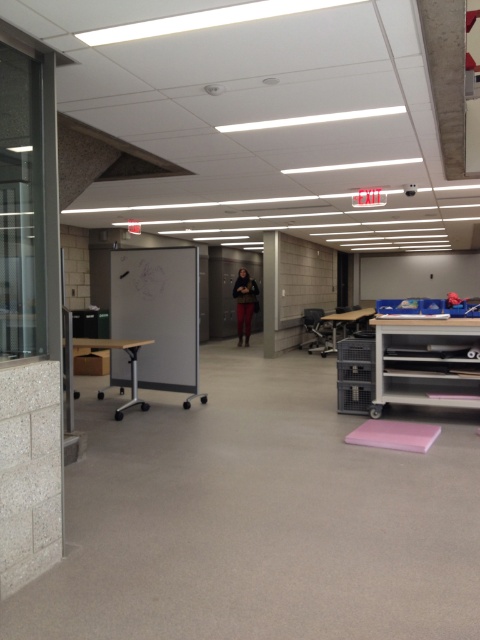
Question: Can you confirm if pink foam yoga mat at lower center is positioned to the right of white concrete pillar at center?

Choices:
 (A) yes
 (B) no

Answer: (A)

Question: Which point appears farthest from the camera in this image?

Choices:
 (A) (275, 282)
 (B) (348, 442)

Answer: (A)

Question: Is pink foam yoga mat at lower center bigger than white concrete pillar at center?

Choices:
 (A) no
 (B) yes

Answer: (A)

Question: Is pink foam yoga mat at lower center positioned before white concrete pillar at center?

Choices:
 (A) yes
 (B) no

Answer: (A)

Question: Which point is farther to the camera?

Choices:
 (A) pink foam yoga mat at lower center
 (B) white concrete pillar at center

Answer: (B)